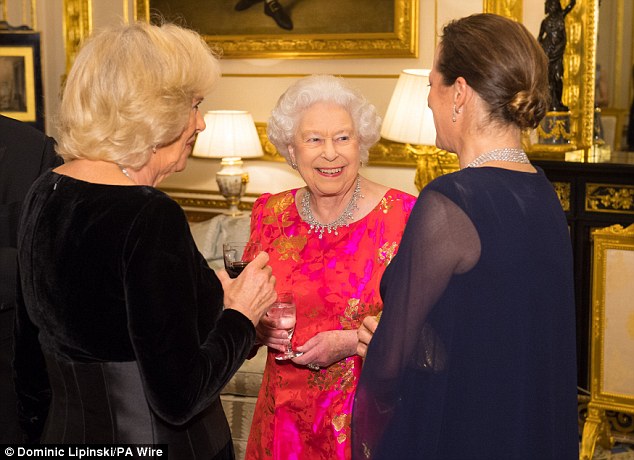
Image resolution: width=634 pixels, height=460 pixels. I want to click on painting, so click(25, 77), click(272, 9).